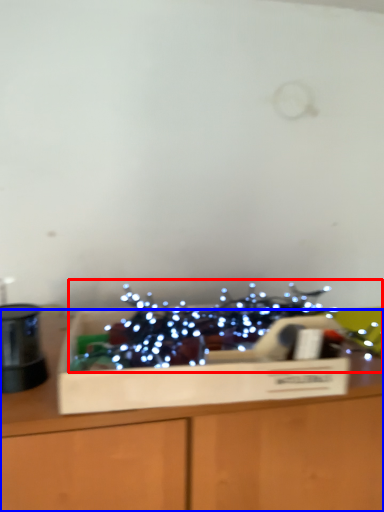
Question: Which of the following is the closest to the observer, christmas decoration (highlighted by a red box) or table (highlighted by a blue box)?

Choices:
 (A) christmas decoration
 (B) table

Answer: (B)